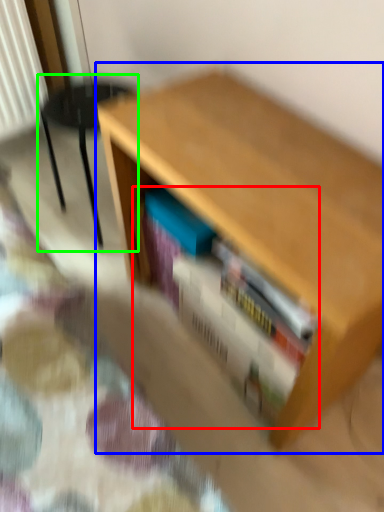
Question: Which object is positioned closest to book (highlighted by a red box)? Select from table (highlighted by a blue box) and armchair (highlighted by a green box).

Choices:
 (A) table
 (B) armchair

Answer: (A)